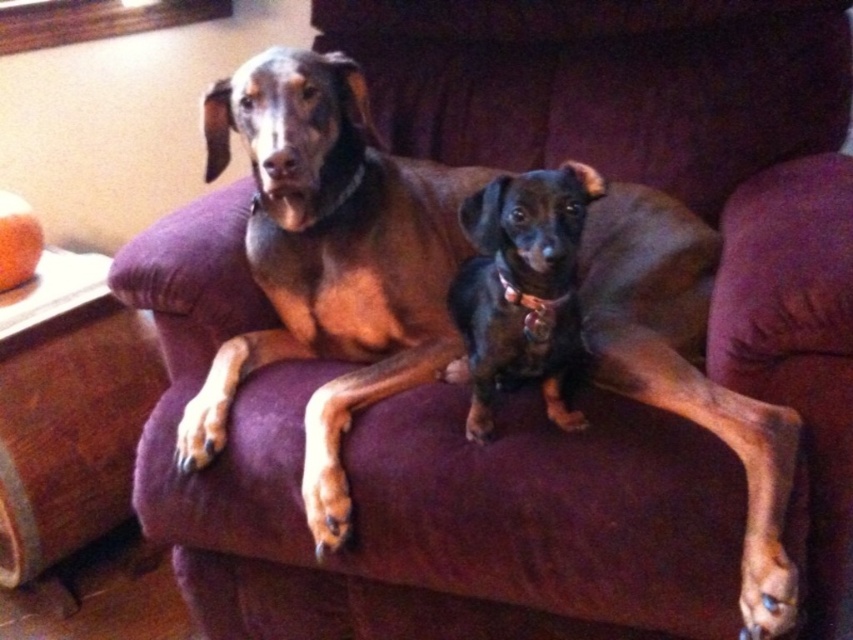
Question: Can you confirm if brown smooth coat dog at center is positioned below black shiny dog at center?

Choices:
 (A) yes
 (B) no

Answer: (A)

Question: Among these points, which one is farthest from the camera?

Choices:
 (A) (502, 243)
 (B) (310, 198)

Answer: (B)

Question: Does brown smooth coat dog at center appear on the left side of black shiny dog at center?

Choices:
 (A) no
 (B) yes

Answer: (B)

Question: Which object is farther from the camera taking this photo?

Choices:
 (A) brown smooth coat dog at center
 (B) black shiny dog at center

Answer: (B)

Question: Is brown smooth coat dog at center further to camera compared to black shiny dog at center?

Choices:
 (A) no
 (B) yes

Answer: (A)